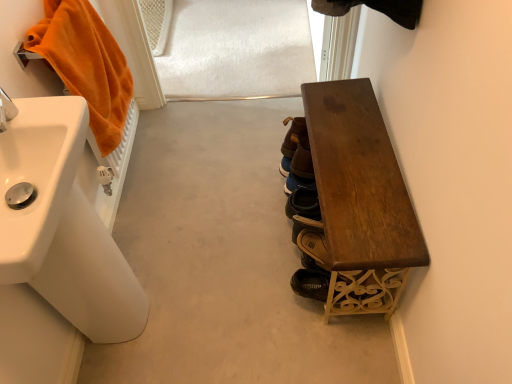
This screenshot has width=512, height=384. I want to click on empty space that is ontop of dark wood bench at right (from a real-world perspective), so point(354,154).